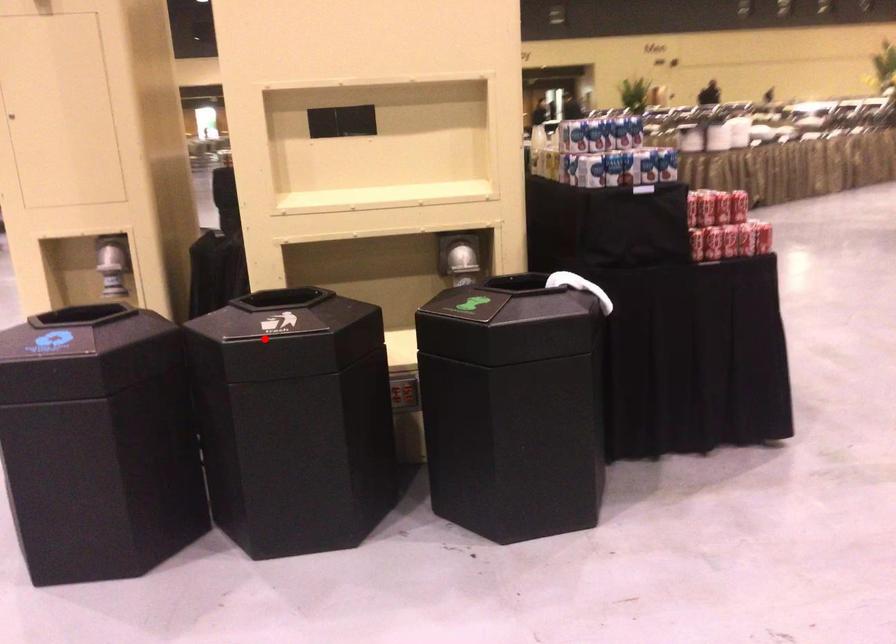
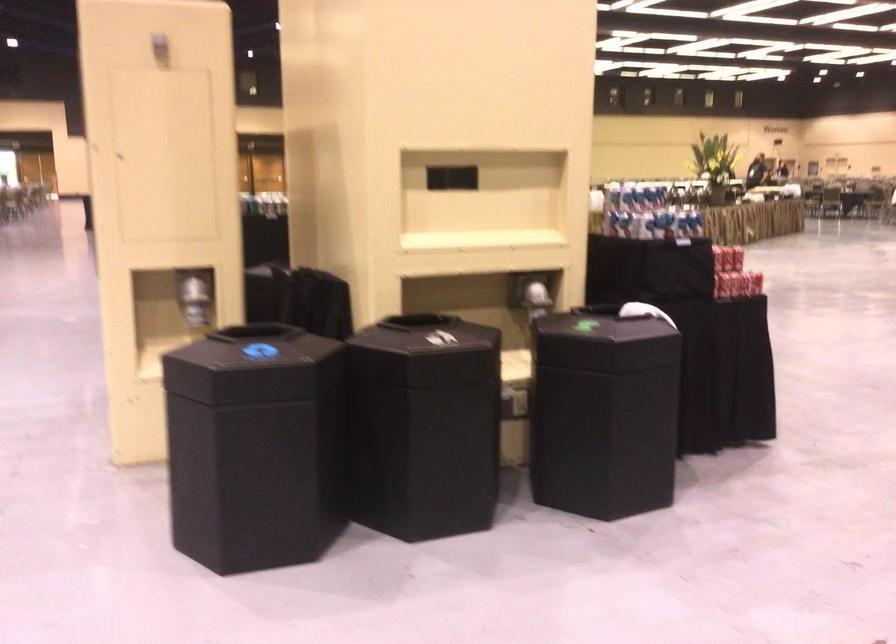
Find the pixel in the second image that matches the highlighted location in the first image.

(425, 351)